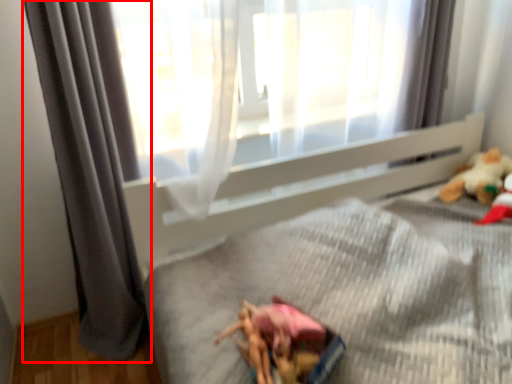
Question: From the image's perspective, what is the correct spatial positioning of curtain (annotated by the red box) in reference to toy?

Choices:
 (A) below
 (B) above

Answer: (A)